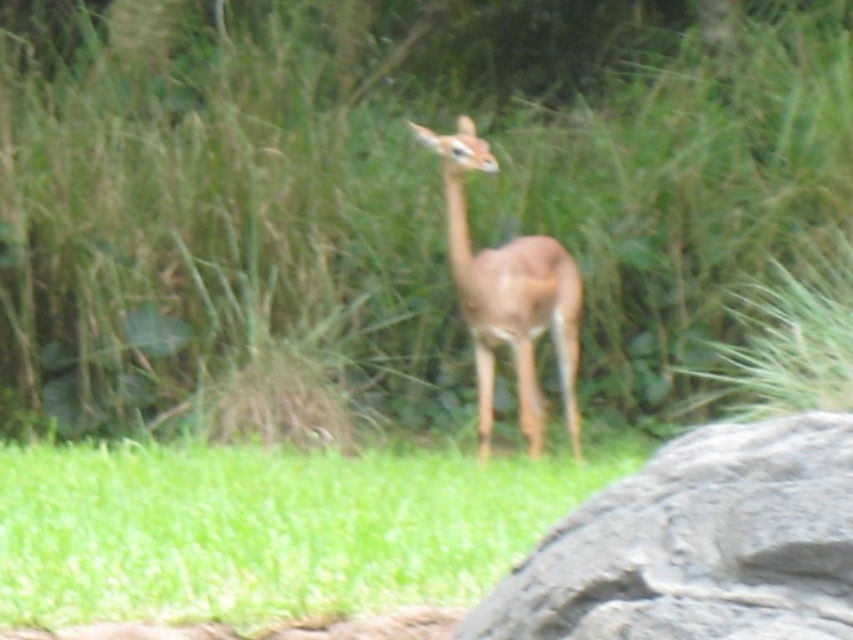
What do you see at coordinates (402, 209) in the screenshot? Image resolution: width=853 pixels, height=640 pixels. I see `green grassy at center` at bounding box center [402, 209].

Between green grassy at center and gray rough rock at center, which one is positioned lower?

gray rough rock at center

Find the location of `green grassy at center`. green grassy at center is located at coordinates (402, 209).

Looking at this image, between green grassy at center and brown matte antelope at center, which one is positioned lower?

brown matte antelope at center

Which is more to the left, green grassy at center or brown matte antelope at center?

green grassy at center

Between point (108, 413) and point (519, 323), which one is positioned behind?

Point (108, 413)

Locate an element on the screen. green grassy at center is located at coordinates (402, 209).

Can you confirm if green grass at center is shorter than brown matte antelope at center?

Indeed, green grass at center has a lesser height compared to brown matte antelope at center.

Does green grass at center have a larger size compared to brown matte antelope at center?

Actually, green grass at center might be smaller than brown matte antelope at center.

Between point (494, 538) and point (544, 262), which one is positioned in front?

Positioned in front is point (494, 538).

Locate an element on the screen. Image resolution: width=853 pixels, height=640 pixels. green grass at center is located at coordinates (270, 528).